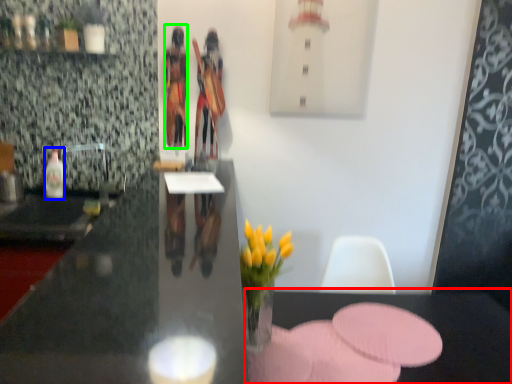
Question: Which object is the closest to the table (highlighted by a red box)? Choose among these: bottle (highlighted by a blue box) or person (highlighted by a green box).

Choices:
 (A) bottle
 (B) person

Answer: (B)